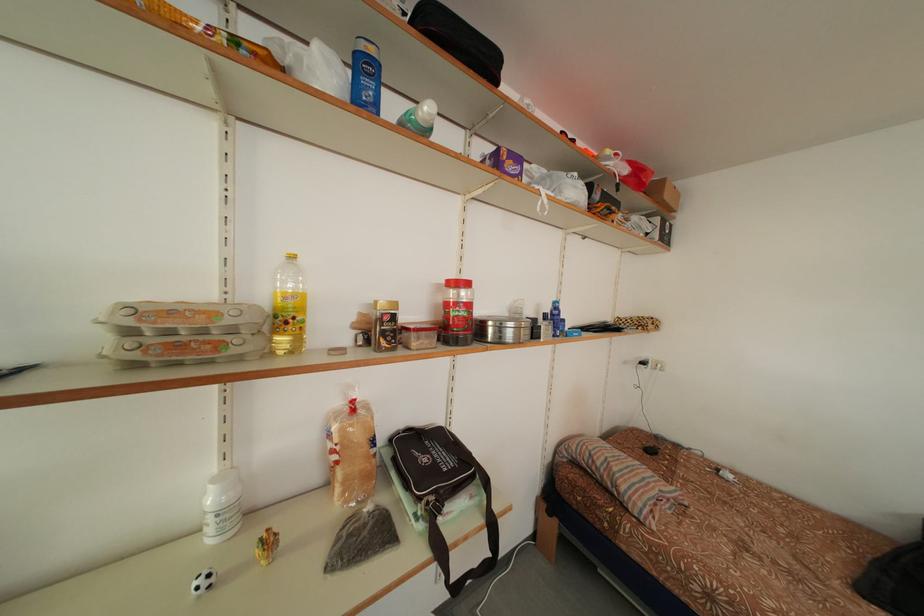
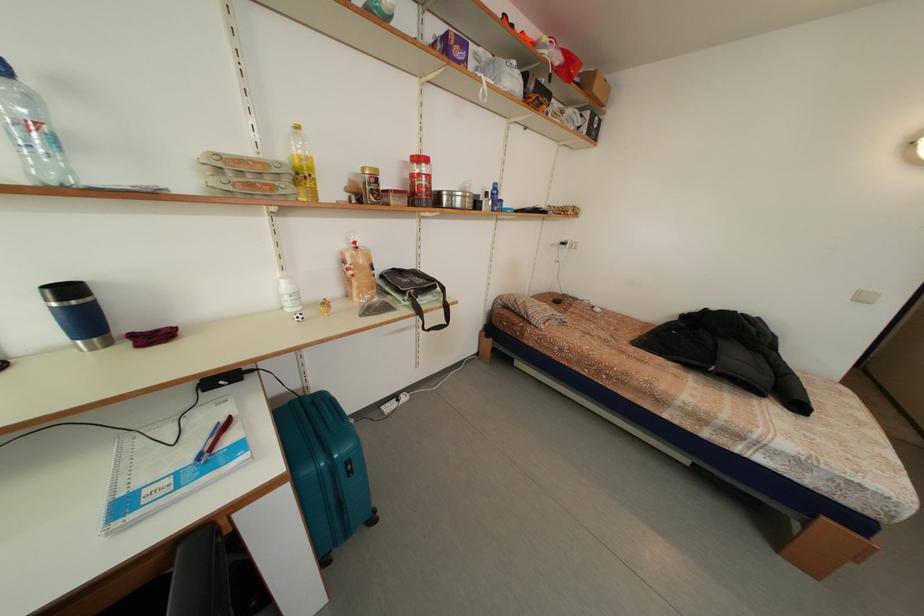
Where in the second image is the point corresponding to (675,201) from the first image?

(603, 95)